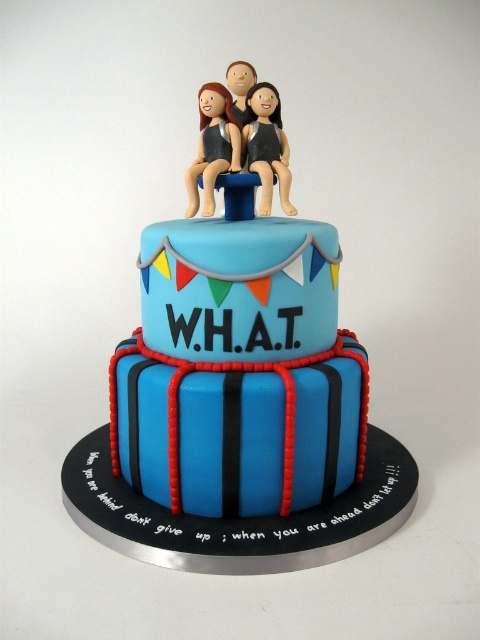
Question: Can you confirm if matte black figurine at center is smaller than smooth plastic figurine at center?

Choices:
 (A) yes
 (B) no

Answer: (B)

Question: Does matte black figurine at center appear under smooth plastic figurine at center?

Choices:
 (A) no
 (B) yes

Answer: (B)

Question: Does matte black figurines at center appear on the right side of smooth plastic figurine at center?

Choices:
 (A) no
 (B) yes

Answer: (B)

Question: Among these points, which one is farthest from the camera?

Choices:
 (A) (214, 104)
 (B) (272, 184)
 (C) (251, 108)

Answer: (C)

Question: Among these objects, which one is farthest from the camera?

Choices:
 (A) matte black figurine at top
 (B) smooth plastic figurine at center

Answer: (B)

Question: Which of these objects is positioned closest to the matte black figurine at center?

Choices:
 (A) smooth plastic figurine at center
 (B) matte black figurine at top

Answer: (B)